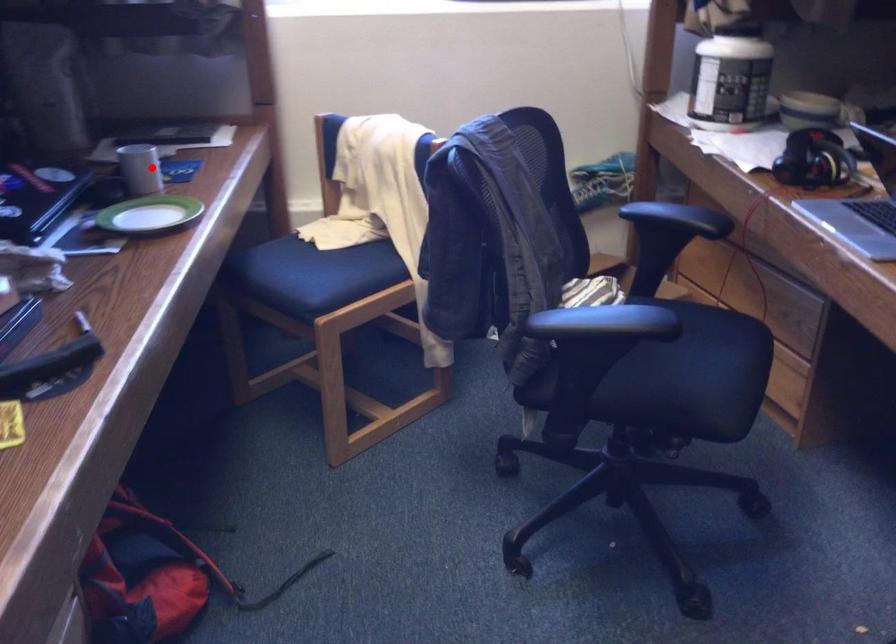
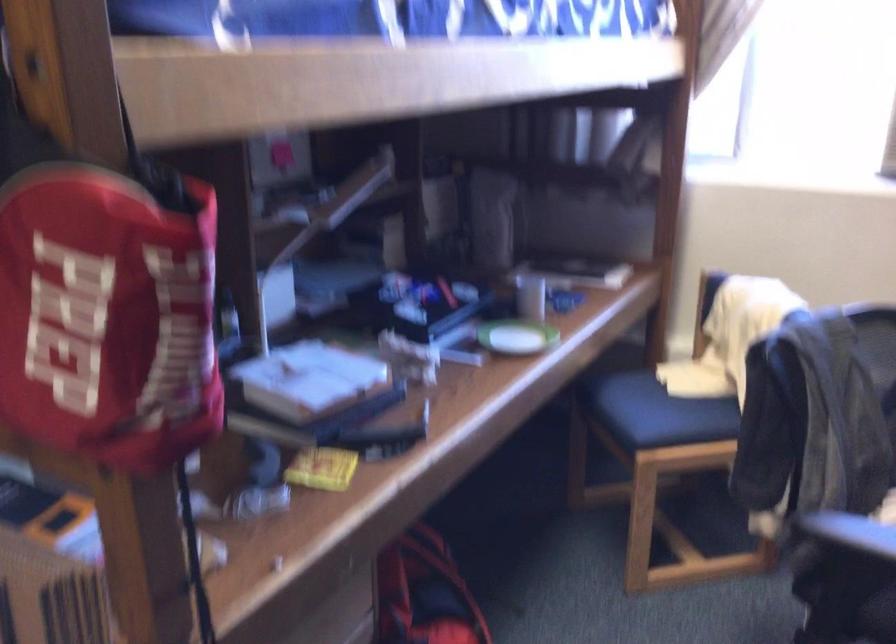
Question: I am providing you with two images of the same scene from different viewpoints. A red point is shown in image1. For the corresponding object point in image2, is it positioned nearer or farther from the camera?

Choices:
 (A) Nearer
 (B) Farther

Answer: (B)